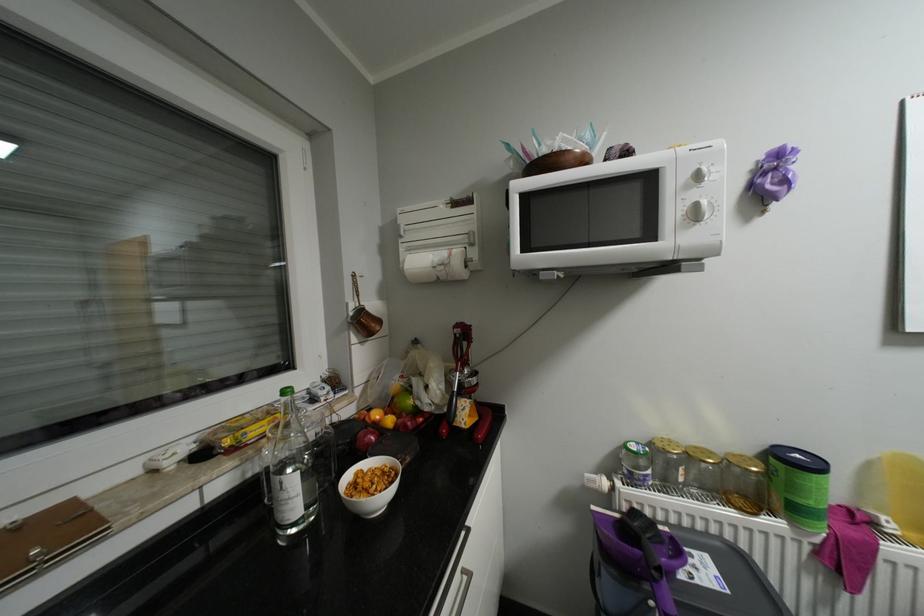
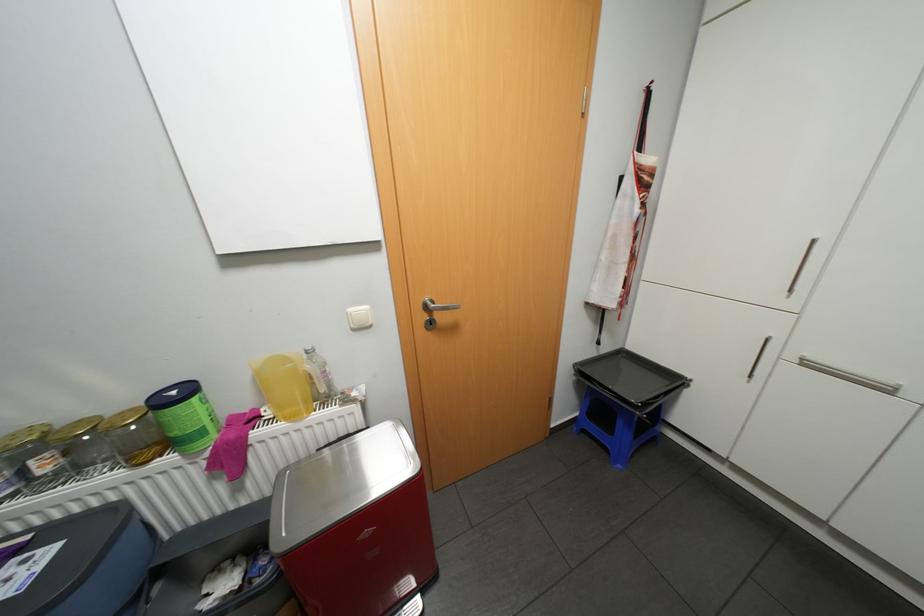
Where in the second image is the point corresponding to (743,455) from the first image?

(128, 411)